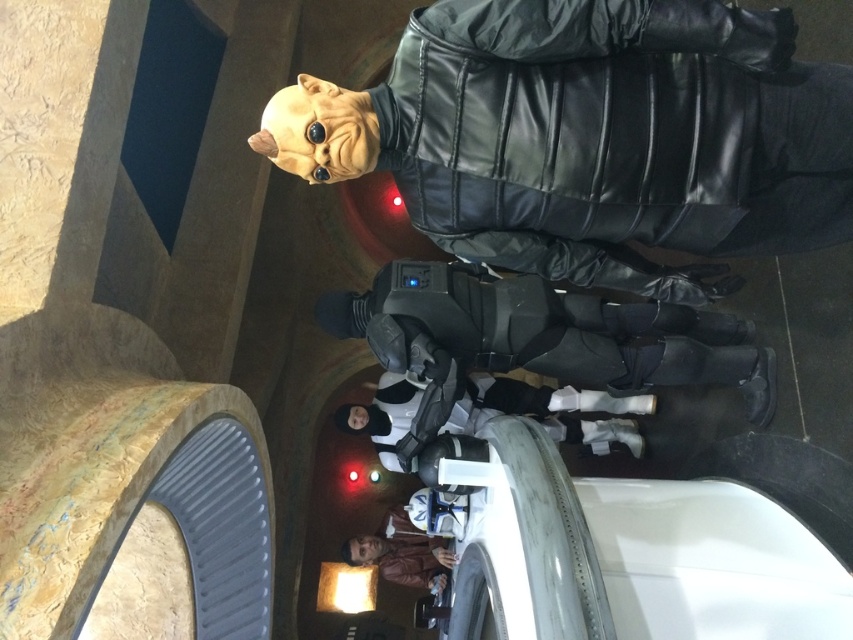
Question: Observing the image, what is the correct spatial positioning of matte black armor at center in reference to white matte robot at center?

Choices:
 (A) below
 (B) above

Answer: (B)

Question: Based on their relative distances, which object is farther from the matte black armor at center?

Choices:
 (A) white matte robot at center
 (B) brown leather jacket at lower center

Answer: (B)

Question: Does matte black armor at center appear on the right side of white matte robot at center?

Choices:
 (A) no
 (B) yes

Answer: (A)

Question: Which of these objects is positioned closest to the white matte robot at center?

Choices:
 (A) matte black armor at center
 (B) brown leather jacket at lower center

Answer: (A)

Question: Which is nearer to the brown leather jacket at lower center?

Choices:
 (A) white matte robot at center
 (B) matte black armor at center

Answer: (A)

Question: Does matte black armor at center have a larger size compared to brown leather jacket at lower center?

Choices:
 (A) no
 (B) yes

Answer: (B)